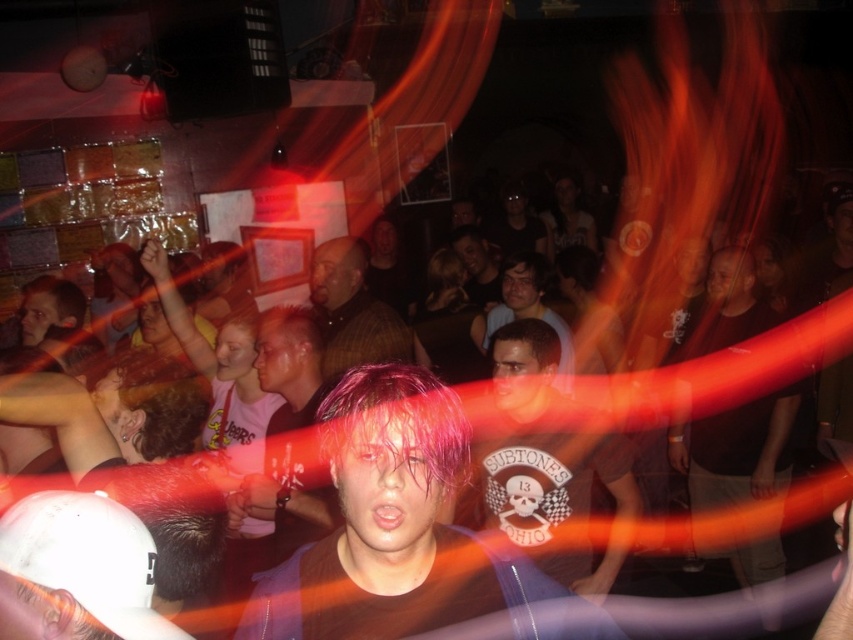
Can you confirm if shiny purple hair at center is shorter than plaid shirt at center?

Yes.

Is point (361, 436) more distant than point (325, 285)?

No, (361, 436) is in front of (325, 285).

Which is behind, point (335, 408) or point (392, 310)?

The point (392, 310) is behind.

You are a GUI agent. You are given a task and a screenshot of the screen. Output one action in this format:
    pyautogui.click(x=<x>, y=<y>)
    Task: Click on the shiny purple hair at center
    
    Given the screenshot: What is the action you would take?
    pyautogui.click(x=403, y=531)

Does pink hair at center lie behind smooth brown hair at center?

No.

Between pink hair at center and smooth brown hair at center, which one appears on the left side from the viewer's perspective?

Positioned to the left is pink hair at center.

Image resolution: width=853 pixels, height=640 pixels. Find the location of `pink hair at center`. pink hair at center is located at coordinates (289, 433).

Is matte brown shirt at center shorter than smooth brown hair at center?

Incorrect, matte brown shirt at center's height does not fall short of smooth brown hair at center's.

Is matte brown shirt at center thinner than smooth brown hair at center?

No, matte brown shirt at center is not thinner than smooth brown hair at center.

This screenshot has height=640, width=853. In order to click on matte brown shirt at center in this screenshot , I will do `click(560, 500)`.